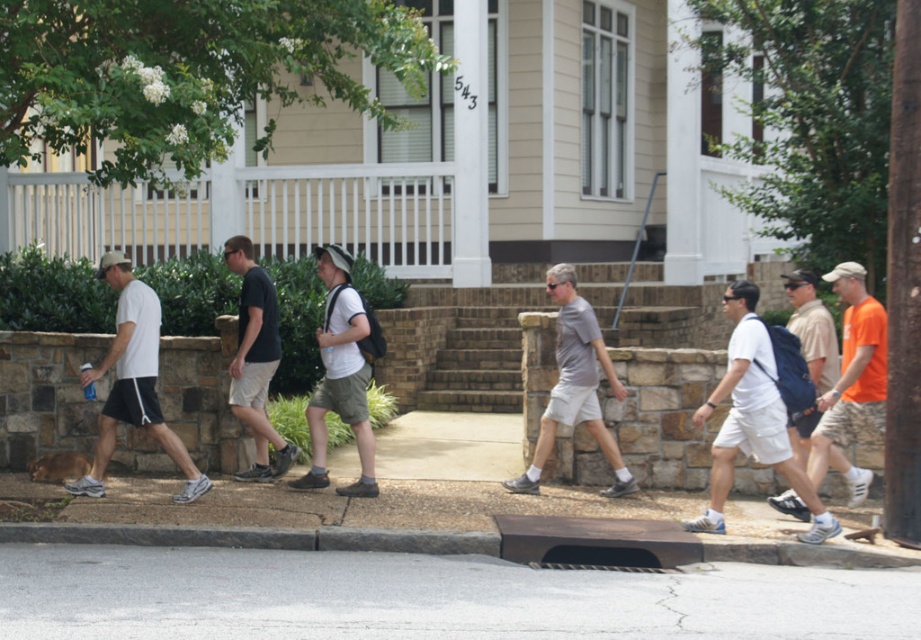
Based on the photo, you are a delivery person trying to place a package on the sidewalk near the brown concrete curb at lower center and the white matte shorts at left. Which object should you avoid placing the package near because it is larger?

You should avoid placing the package near the white matte shorts at left because it is larger than the brown concrete curb at lower center.